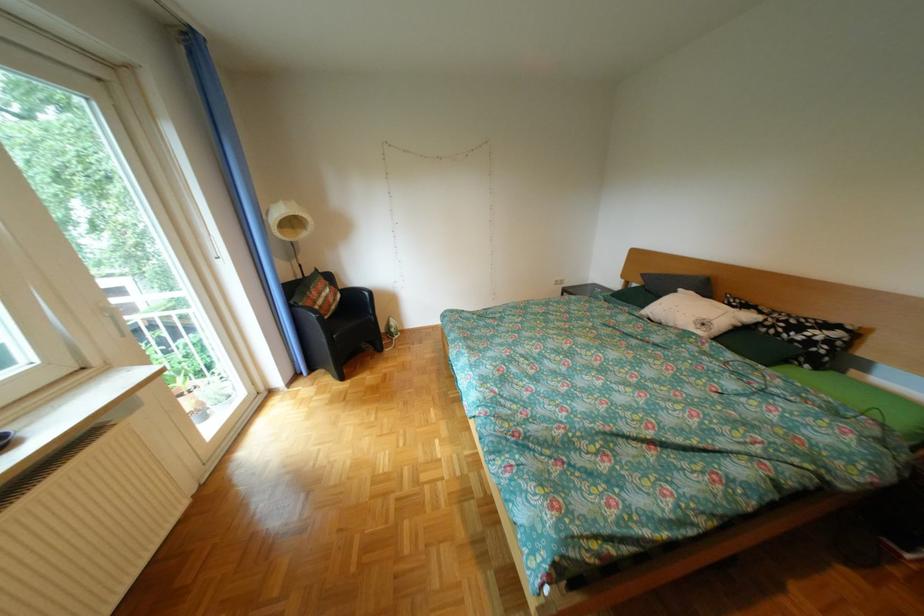
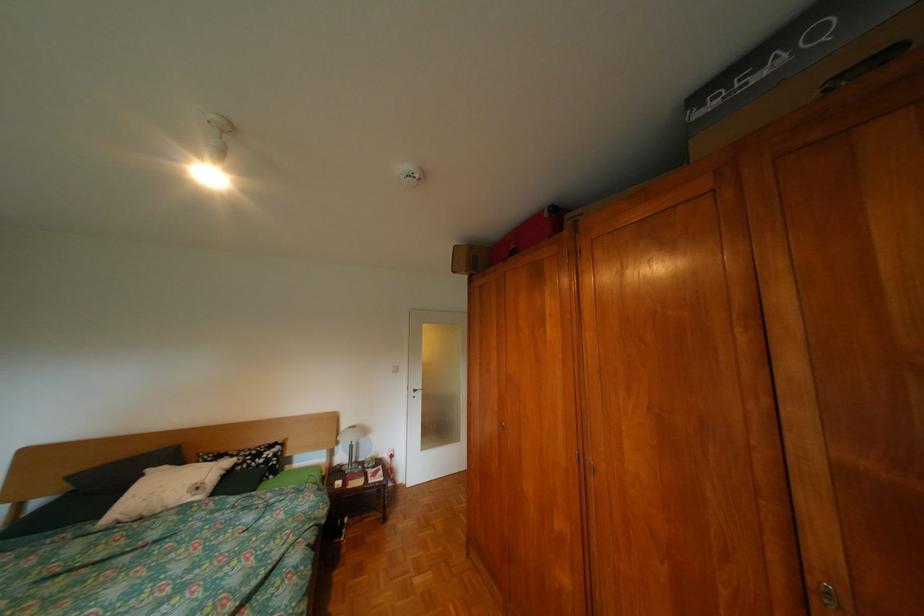
Question: Based on the continuous images, in which direction is the camera rotating? Reply with the corresponding letter.

Choices:
 (A) Left
 (B) Right
 (C) Up
 (D) Down

Answer: (B)